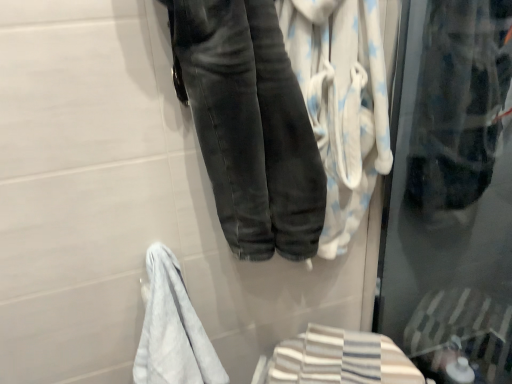
Question: Considering the relative positions of white soft towel at center, positioned as the 2th bath towel in bottom-to-top order, and striped cotton bath towel at lower right, which ranks as the 2th bath towel in top-to-bottom order, in the image provided, is white soft towel at center, positioned as the 2th bath towel in bottom-to-top order, to the right of striped cotton bath towel at lower right, which ranks as the 2th bath towel in top-to-bottom order, from the viewer's perspective?

Choices:
 (A) yes
 (B) no

Answer: (B)

Question: Is the depth of white soft towel at center, positioned as the 2th bath towel in bottom-to-top order, greater than that of striped cotton bath towel at lower right, the first bath towel in the bottom-to-top sequence?

Choices:
 (A) no
 (B) yes

Answer: (A)

Question: Is white soft towel at center, positioned as the 2th bath towel in bottom-to-top order, to the left of striped cotton bath towel at lower right, the first bath towel in the bottom-to-top sequence, from the viewer's perspective?

Choices:
 (A) yes
 (B) no

Answer: (A)

Question: From a real-world perspective, is white soft towel at center, the 1th bath towel viewed from the top, beneath striped cotton bath towel at lower right, which ranks as the 2th bath towel in top-to-bottom order?

Choices:
 (A) no
 (B) yes

Answer: (A)

Question: From the image's perspective, is white soft towel at center, positioned as the 2th bath towel in bottom-to-top order, on top of striped cotton bath towel at lower right, which ranks as the 2th bath towel in top-to-bottom order?

Choices:
 (A) no
 (B) yes

Answer: (B)

Question: Is white soft towel at center, the 1th bath towel viewed from the top, directly adjacent to striped cotton bath towel at lower right, which ranks as the 2th bath towel in top-to-bottom order?

Choices:
 (A) no
 (B) yes

Answer: (A)

Question: Considering the relative positions of transparent plastic bag at upper right and dark gray denim jeans at center in the image provided, is transparent plastic bag at upper right behind dark gray denim jeans at center?

Choices:
 (A) yes
 (B) no

Answer: (A)

Question: Is transparent plastic bag at upper right at the right side of dark gray denim jeans at center?

Choices:
 (A) no
 (B) yes

Answer: (B)

Question: Is transparent plastic bag at upper right shorter than dark gray denim jeans at center?

Choices:
 (A) yes
 (B) no

Answer: (B)

Question: Is transparent plastic bag at upper right outside dark gray denim jeans at center?

Choices:
 (A) yes
 (B) no

Answer: (A)

Question: From the image's perspective, does transparent plastic bag at upper right appear lower than dark gray denim jeans at center?

Choices:
 (A) no
 (B) yes

Answer: (A)

Question: Are transparent plastic bag at upper right and dark gray denim jeans at center beside each other?

Choices:
 (A) no
 (B) yes

Answer: (A)

Question: Is white soft towel at center, the 1th bath towel viewed from the top, positioned far away from dark gray denim jeans at center?

Choices:
 (A) yes
 (B) no

Answer: (B)